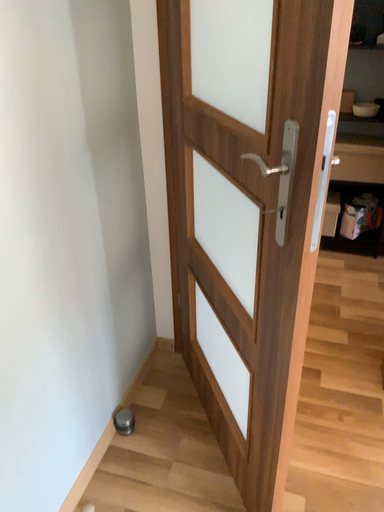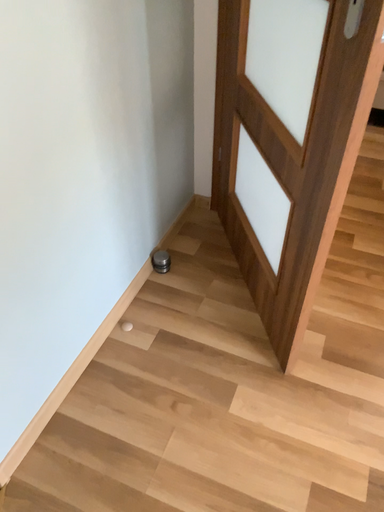
Question: Which way did the camera rotate in the video?

Choices:
 (A) rotated downward
 (B) rotated upward

Answer: (A)